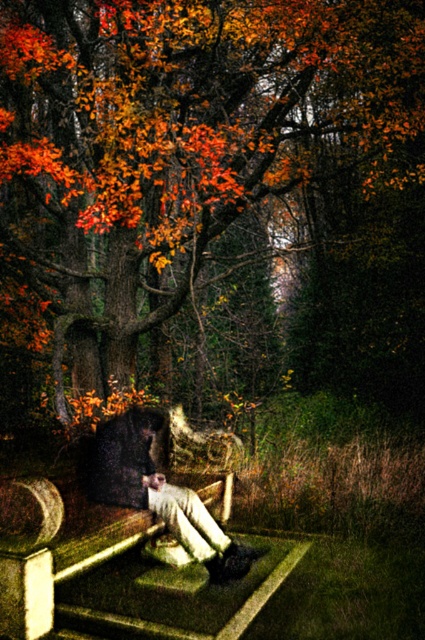
You are a photographer wanting to capture a closeup of the autumn leaves at center and the matte black coat at center in the scene. Which object should you zoom in on to ensure it appears larger in your photo?

Since the autumn leaves at center is not as tall as the matte black coat at center, you should zoom in on the matte black coat at center to make it appear larger in the photo.

You are planning to place a 6 meter long wooden bench between the autumn leaves at center and the matte black coat at center. Will the bench fit in the available space?

The distance between autumn leaves at center and matte black coat at center is 5.75 meters. Since the bench is 6 meters long, it will not fit in the available space as it is slightly longer than the distance between them.